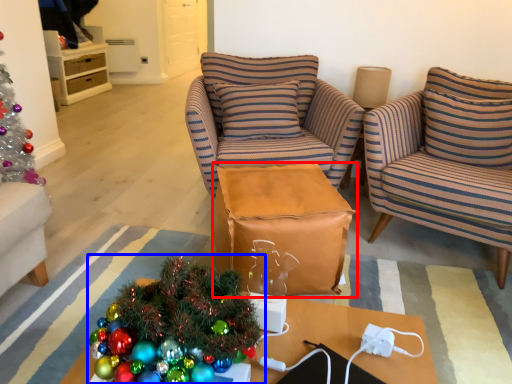
Question: Which object is closer to the camera taking this photo, table (highlighted by a red box) or christmas tree (highlighted by a blue box)?

Choices:
 (A) table
 (B) christmas tree

Answer: (B)